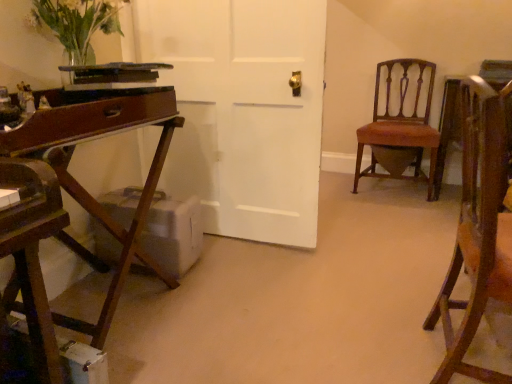
Question: Is translucent glass vase at upper left taller than mahogany wood chair at right, which is the 1th chair from back to front?

Choices:
 (A) yes
 (B) no

Answer: (B)

Question: Is translucent glass vase at upper left looking in the opposite direction of mahogany wood chair at right, the 2th chair positioned from the front?

Choices:
 (A) no
 (B) yes

Answer: (A)

Question: Can you confirm if translucent glass vase at upper left is bigger than mahogany wood chair at right, the 2th chair positioned from the front?

Choices:
 (A) yes
 (B) no

Answer: (B)

Question: From a real-world perspective, is translucent glass vase at upper left beneath mahogany wood chair at right, the 2th chair positioned from the front?

Choices:
 (A) yes
 (B) no

Answer: (B)

Question: Does translucent glass vase at upper left have a lesser height compared to mahogany wood chair at right, which is the 1th chair from back to front?

Choices:
 (A) yes
 (B) no

Answer: (A)

Question: Considering the relative sizes of translucent glass vase at upper left and mahogany wood chair at right, the 2th chair positioned from the front, in the image provided, is translucent glass vase at upper left wider than mahogany wood chair at right, the 2th chair positioned from the front,?

Choices:
 (A) no
 (B) yes

Answer: (A)

Question: Is mahogany wood chair at right, which is the 1th chair from back to front, far from translucent glass vase at upper left?

Choices:
 (A) no
 (B) yes

Answer: (B)

Question: Can you confirm if mahogany wood chair at right, which is the 1th chair from back to front, is bigger than translucent glass vase at upper left?

Choices:
 (A) yes
 (B) no

Answer: (A)

Question: Does mahogany wood chair at right, the 2th chair positioned from the front, have a lesser height compared to translucent glass vase at upper left?

Choices:
 (A) no
 (B) yes

Answer: (A)

Question: Is translucent glass vase at upper left surrounded by mahogany wood chair at right, the 2th chair positioned from the front?

Choices:
 (A) yes
 (B) no

Answer: (B)

Question: Is mahogany wood chair at right, which is the 1th chair from back to front, taller than translucent glass vase at upper left?

Choices:
 (A) no
 (B) yes

Answer: (B)

Question: From a real-world perspective, is mahogany wood chair at right, the 2th chair positioned from the front, located beneath translucent glass vase at upper left?

Choices:
 (A) no
 (B) yes

Answer: (B)

Question: Can you see translucent glass vase at upper left touching wooden chair at right, positioned as the 1th chair in front-to-back order?

Choices:
 (A) no
 (B) yes

Answer: (A)